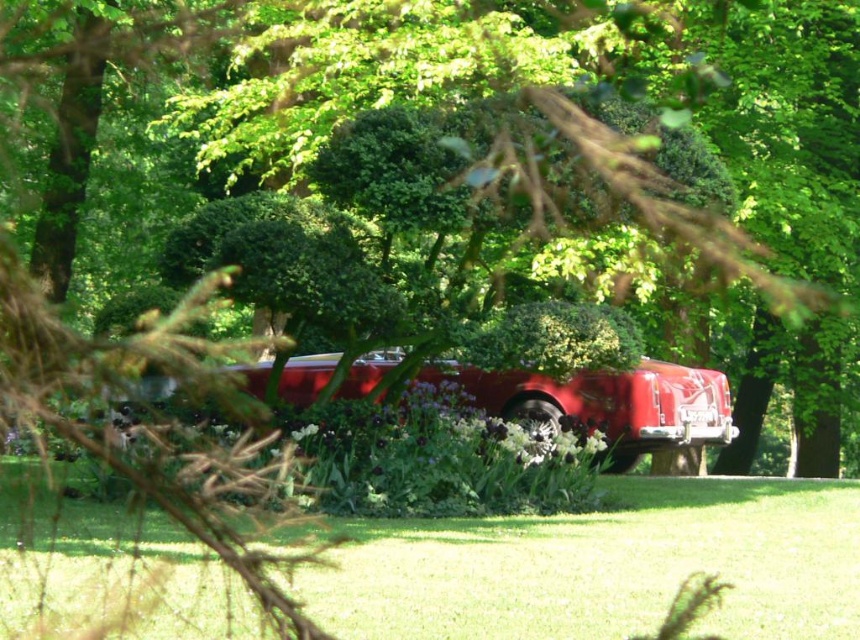
Question: Among these objects, which one is nearest to the camera?

Choices:
 (A) green leafy bush at center
 (B) green grass at lower center

Answer: (B)

Question: Estimate the real-world distances between objects in this image. Which object is farther from the green grass at lower center?

Choices:
 (A) glossy red car at center
 (B) green leafy bush at center

Answer: (A)

Question: Is green grass at lower center thinner than green leafy bush at center?

Choices:
 (A) no
 (B) yes

Answer: (B)

Question: Is green grass at lower center to the left of glossy red car at center from the viewer's perspective?

Choices:
 (A) yes
 (B) no

Answer: (A)

Question: Is green leafy tree at center to the left of glossy red car at center from the viewer's perspective?

Choices:
 (A) yes
 (B) no

Answer: (A)

Question: Among these objects, which one is farthest from the camera?

Choices:
 (A) glossy red car at center
 (B) green leafy bush at center

Answer: (A)